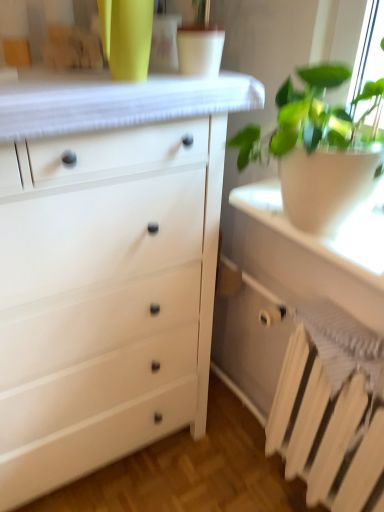
Locate an element on the screen. This screenshot has width=384, height=512. free space above white painted metal radiator at lower right (from a real-world perspective) is located at coordinates (365, 339).